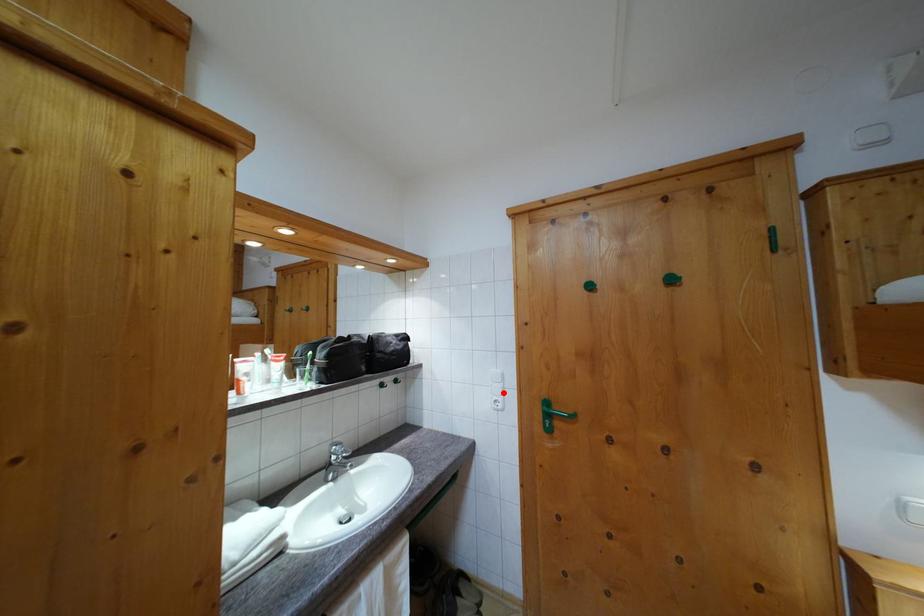
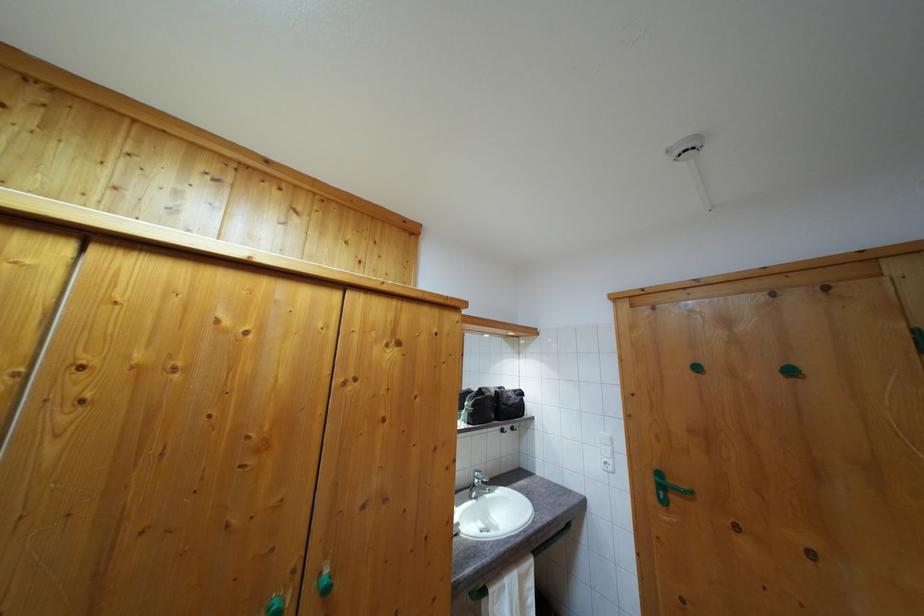
Where in the second image is the point corresponding to the highlighted location from the first image?

(613, 456)